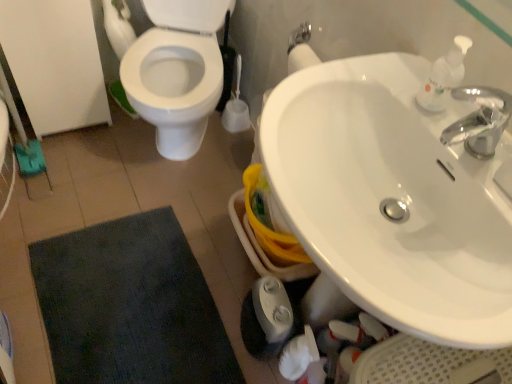
Where is `vacant space situated on the left part of white plastic soap dispenser at upper right`? vacant space situated on the left part of white plastic soap dispenser at upper right is located at coordinates (366, 82).